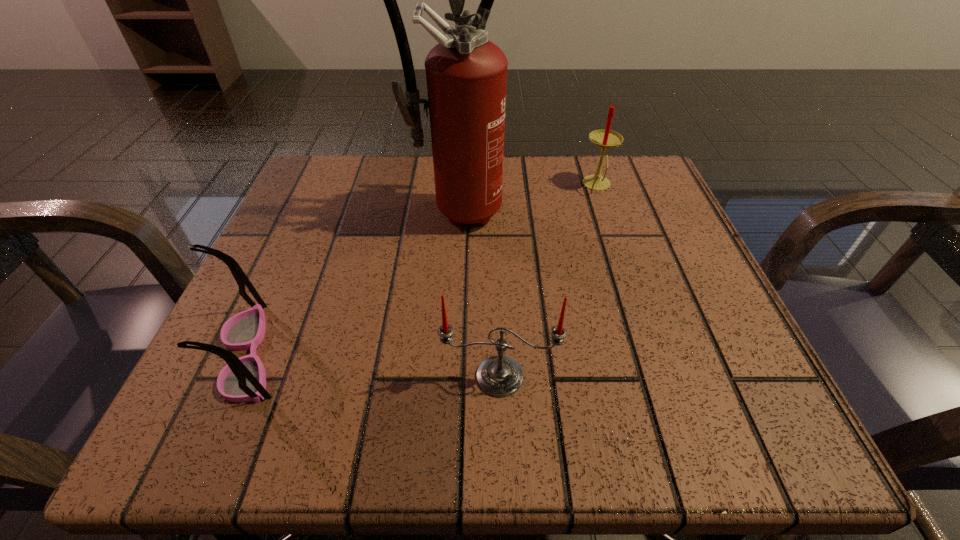
Where is `empty location between the nearer candle and the fire extinguisher`? empty location between the nearer candle and the fire extinguisher is located at coordinates (477, 293).

You are a GUI agent. You are given a task and a screenshot of the screen. Output one action in this format:
    pyautogui.click(x=<x>, y=<y>)
    Task: Click on the vacant space that's between the nearer candle and the leftmost object
    The width and height of the screenshot is (960, 540).
    Given the screenshot: What is the action you would take?
    coord(374,365)

Locate an element on the screen. This screenshot has width=960, height=540. vacant region between the fire extinguisher and the nearer candle is located at coordinates (477, 293).

This screenshot has height=540, width=960. Identify the location of the closest object to the fire extinguisher. (x=605, y=138).

The width and height of the screenshot is (960, 540). In order to click on object that is the closest one to the nearer candle in this screenshot , I will do `click(243, 379)`.

At what (x,y) coordinates should I click in order to perform the action: click on vacant space that satisfies the following two spatial constraints: 1. on the back side of the leftmost object; 2. on the left side of the farther candle. Please return your answer as a coordinate pair (x, y). The width and height of the screenshot is (960, 540). Looking at the image, I should click on (324, 185).

Locate an element on the screen. vacant space that satisfies the following two spatial constraints: 1. on the back side of the leftmost object; 2. on the left side of the farther candle is located at coordinates (324, 185).